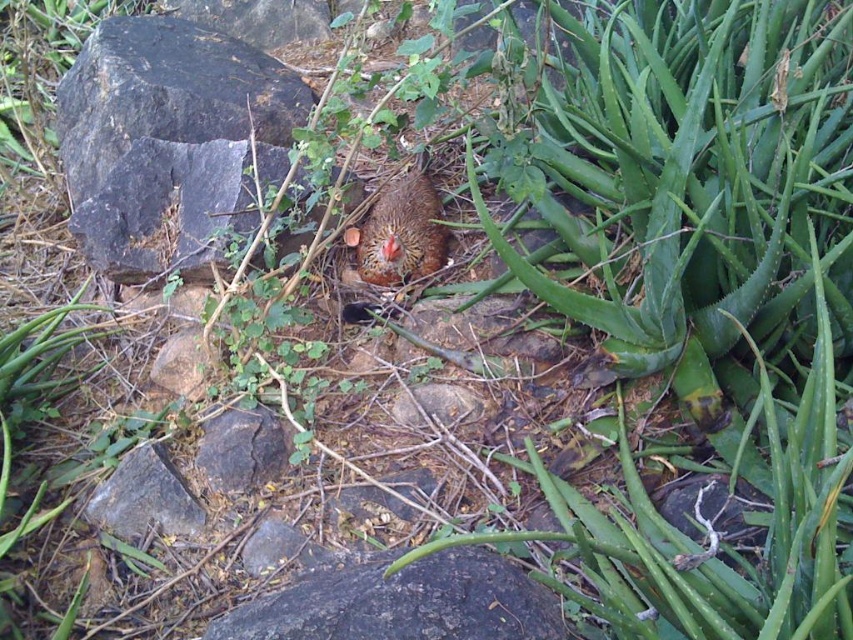
Who is positioned more to the right, black rough rock at center or brown speckled chicken at center?

black rough rock at center is more to the right.

Between black rough rock at center and brown speckled chicken at center, which one is positioned lower?

Positioned lower is black rough rock at center.

Between point (447, 634) and point (392, 266), which one is positioned in front?

Point (447, 634)

Identify the location of black rough rock at center. This screenshot has width=853, height=640. (403, 602).